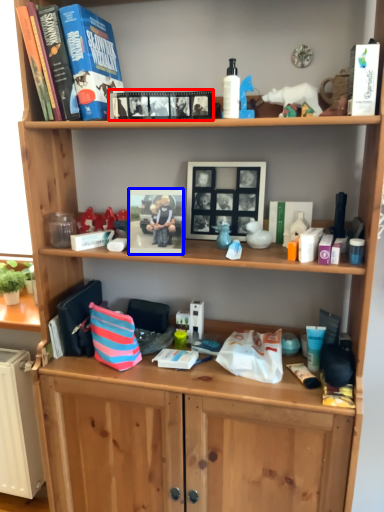
Question: Which point is further to the camera, book (highlighted by a red box) or picture frame (highlighted by a blue box)?

Choices:
 (A) book
 (B) picture frame

Answer: (B)